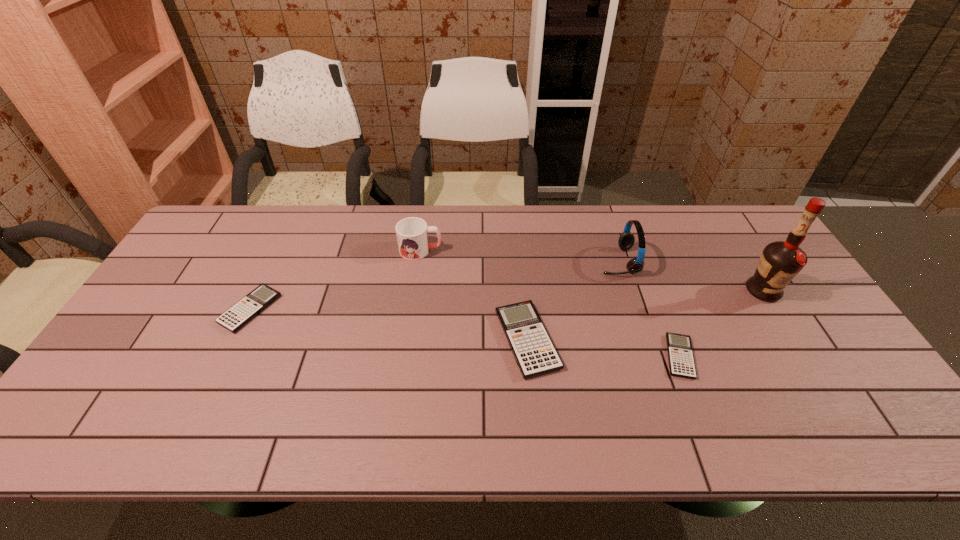
The image size is (960, 540). Identify the location of free space that satisfies the following two spatial constraints: 1. on the back side of the rightmost calculator; 2. with the microphone attached to the side of the fifth shortest object. (643, 261).

Locate an element on the screen. This screenshot has height=540, width=960. vacant space that satisfies the following two spatial constraints: 1. on the front side of the leftmost calculator; 2. on the left side of the rightmost calculator is located at coordinates (228, 356).

At what (x,y) coordinates should I click in order to perform the action: click on vacant region that satisfies the following two spatial constraints: 1. on the side of the fifth object from right to left with the handle; 2. on the back side of the second calculator from right to left. Please return your answer as a coordinate pair (x, y). The width and height of the screenshot is (960, 540). Looking at the image, I should click on (408, 340).